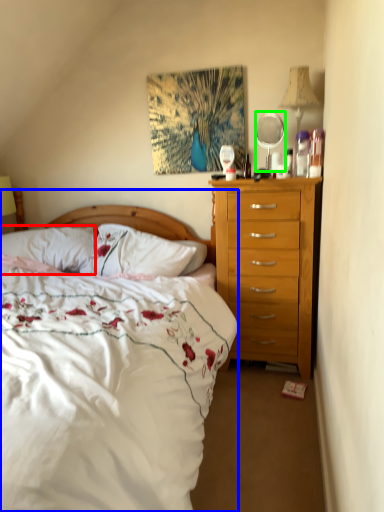
Question: Estimate the real-world distances between objects in this image. Which object is farther from pillow (highlighted by a red box), bed (highlighted by a blue box) or mirror (highlighted by a green box)?

Choices:
 (A) bed
 (B) mirror

Answer: (B)